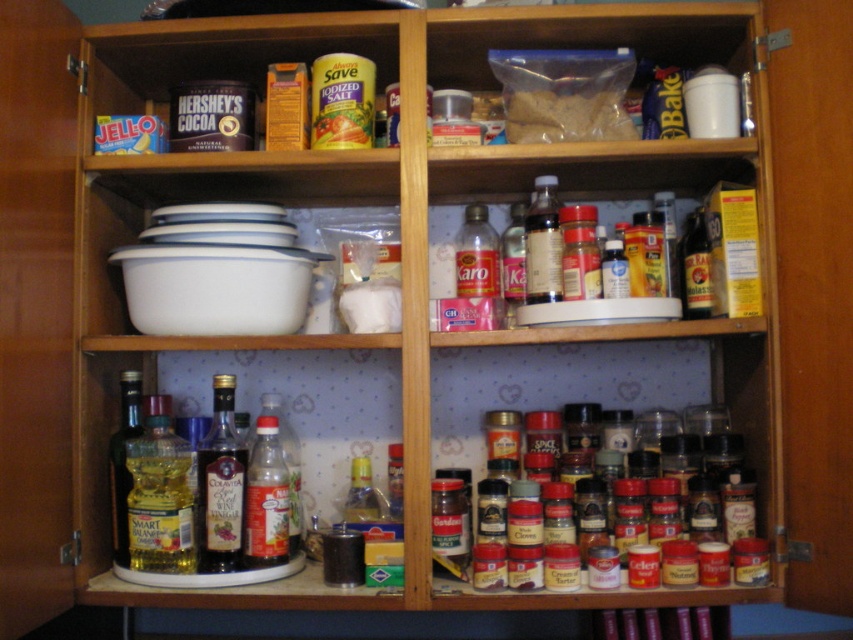
Looking at this image, you are a delivery person who just arrived at the house to drop off a large package. You need to place the package on a surface that is at least 1.5 meters away from the translucent plastic bottle at lower left. Is the middle shelf of the cabinet a suitable place for this?

The distance of the translucent plastic bottle at lower left from the camera is 1.23 meters. Since the middle shelf is part of the same cabinet, placing the package there would not meet the requirement of being at least 1.5 meters away from the bottle.

Consider the image. You are standing in front of the cabinet and want to reach the shiny dark brown bottle at upper center. If your maximum reaching height is 4 feet, can you safely reach it?

The shiny dark brown bottle at upper center is 4.10 feet away from the viewer, which is slightly beyond your maximum reaching height of 4 feet. You may need to use a stool or step up to safely reach it.

Which object is the point at coordinate (543, 243) on?

The point at coordinate (543, 243) is on the shiny dark brown bottle at upper center.